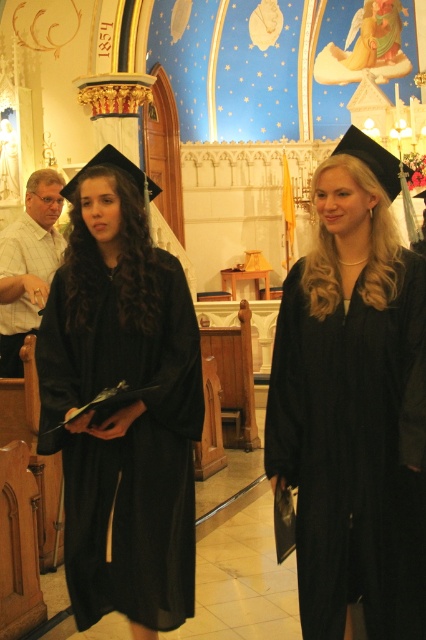
Question: Among these points, which one is farthest from the camera?

Choices:
 (A) (0, 269)
 (B) (371, 560)

Answer: (A)

Question: Does matte black gown at left appear under white checkered shirt at left?

Choices:
 (A) no
 (B) yes

Answer: (B)

Question: Estimate the real-world distances between objects in this image. Which object is farther from the matte black graduation gown at center?

Choices:
 (A) white checkered shirt at left
 (B) matte black gown at left

Answer: (A)

Question: Which object is the farthest from the white checkered shirt at left?

Choices:
 (A) matte black gown at left
 (B) matte black graduation gown at center

Answer: (B)

Question: Does matte black graduation gown at center lie in front of matte black gown at left?

Choices:
 (A) yes
 (B) no

Answer: (A)

Question: Is matte black gown at left to the right of white checkered shirt at left from the viewer's perspective?

Choices:
 (A) yes
 (B) no

Answer: (A)